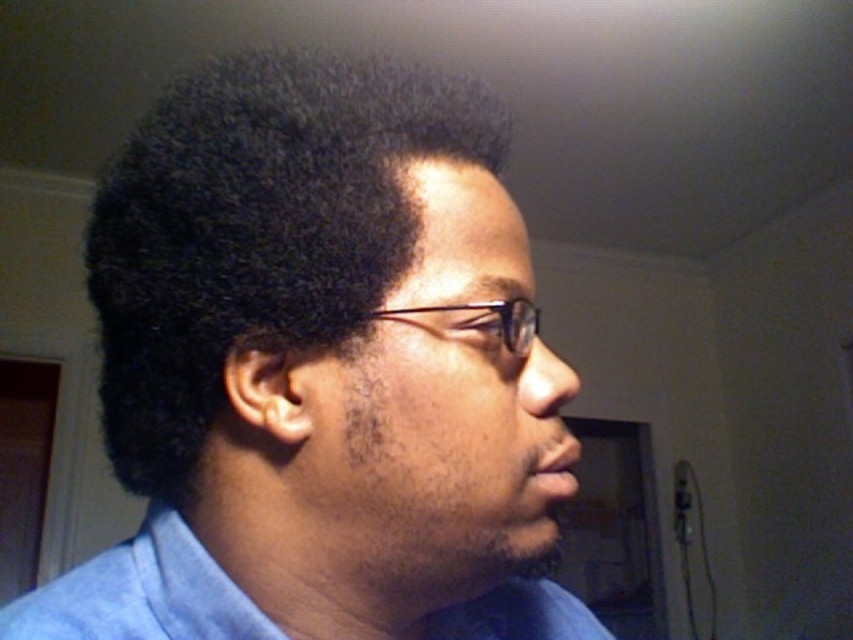
Is black matte afro at center further to camera compared to blue cotton dress shirt at lower center?

No, black matte afro at center is in front of blue cotton dress shirt at lower center.

Is black matte afro at center taller than blue cotton dress shirt at lower center?

Correct, black matte afro at center is much taller as blue cotton dress shirt at lower center.

What do you see at coordinates (256, 230) in the screenshot? I see `black matte afro at center` at bounding box center [256, 230].

Locate an element on the screen. This screenshot has height=640, width=853. black matte afro at center is located at coordinates (256, 230).

What do you see at coordinates (256, 230) in the screenshot?
I see `black matte afro at center` at bounding box center [256, 230].

Is point (207, 90) positioned behind point (474, 301)?

Yes, it is.

Locate an element on the screen. The image size is (853, 640). black matte afro at center is located at coordinates (256, 230).

Where is `black matte afro at center`? Image resolution: width=853 pixels, height=640 pixels. black matte afro at center is located at coordinates (256, 230).

What do you see at coordinates (141, 595) in the screenshot? This screenshot has height=640, width=853. I see `blue cotton dress shirt at lower center` at bounding box center [141, 595].

From the picture: Is blue cotton dress shirt at lower center shorter than clear plastic glasses at center?

Incorrect, blue cotton dress shirt at lower center's height does not fall short of clear plastic glasses at center's.

Between point (178, 518) and point (508, 323), which one is positioned behind?

Positioned behind is point (178, 518).

Locate an element on the screen. blue cotton dress shirt at lower center is located at coordinates (141, 595).